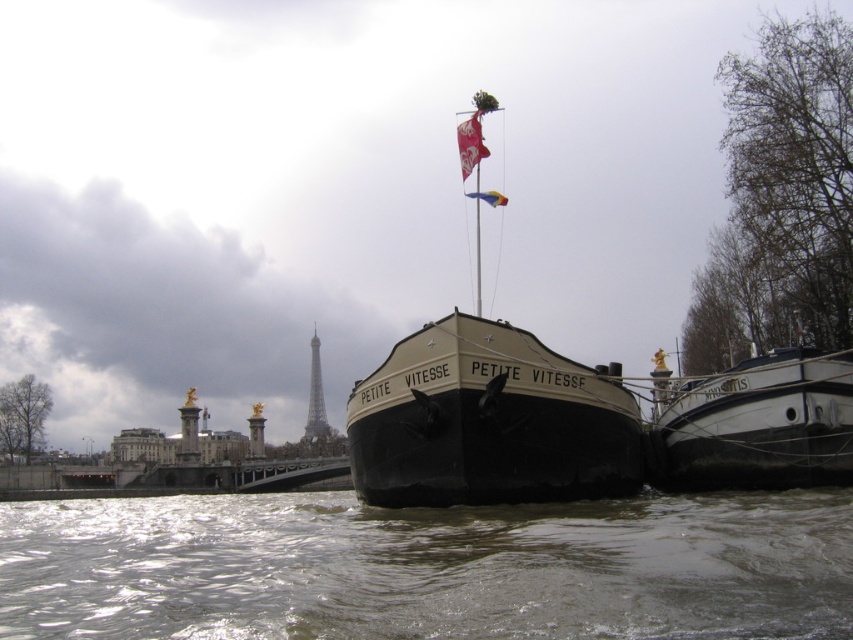
You are a photographer planning to capture a wide shot of the white matte boat at right and the red fabric flag at upper center. Given their widths, which object should you frame first to ensure both fit in the shot?

The white matte boat at right is wider than the red fabric flag at upper center. To ensure both fit in the shot, frame the white matte boat at right first as it requires more space, then adjust the shot to include the red fabric flag at upper center.

You are a delivery drone with a wingspan of 6 feet. You need to fly from the brown murky water at lower center to the black matte barge at center. Is there enough space between them for your flight path?

The brown murky water at lower center and black matte barge at center are 79.84 feet apart from each other, so yes, the drone can fly between them as the distance is more than sufficient for its 6 feet wingspan.

You are a photographer planning to capture the Eiffel Tower in the background with both the brown murky water at lower center and the black matte barge at center in the frame. Which object should you focus on first if you want to ensure both are in focus without adjusting the camera settings?

The black matte barge at center is larger than the brown murky water at lower center, so focusing on the larger object first would help maintain focus on both without needing to adjust the camera settings.